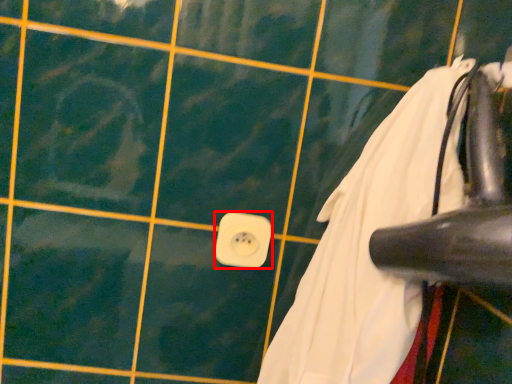
Question: From the image, what is the correct spatial relationship of power plugs and sockets (annotated by the red box) in relation to laundry?

Choices:
 (A) right
 (B) left

Answer: (B)